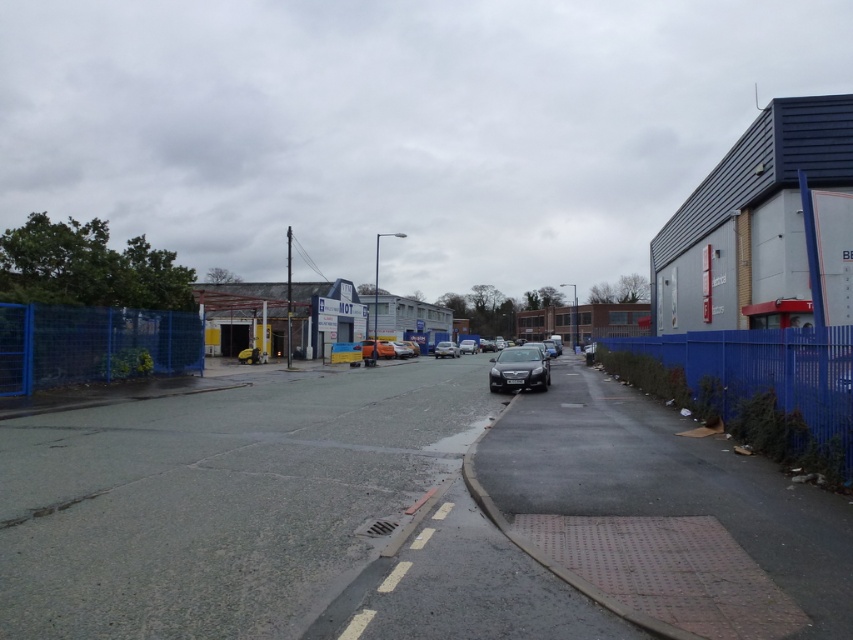
You are a delivery driver who needs to park your truck between the orange matte car at center and the shiny silver car at center. Given that your truck is 6 meters long, can you fit it in the space between them?

The orange matte car at center is bigger than the shiny silver car at center, but the exact distance between them is not provided. Without knowing the space between the two cars, it is impossible to determine if the truck can fit.

You are standing at the point marked by the coordinates point (91, 344) in the image. What object are you currently standing on?

The point (91, 344) indicates blue mesh fence at lower left, so you are standing on the blue mesh fence at lower left.

You are a delivery driver who needs to park your vehicle on the street. The blue mesh fence at lower left and the blue metal fence at right are both along the street. Which fence section would allow you to park your vehicle closer to the curb without blocking the sidewalk?

The blue mesh fence at lower left occupies less space than the blue metal fence at right, so parking near the blue mesh fence at lower left would allow more space for the vehicle to park closer to the curb without blocking the sidewalk.